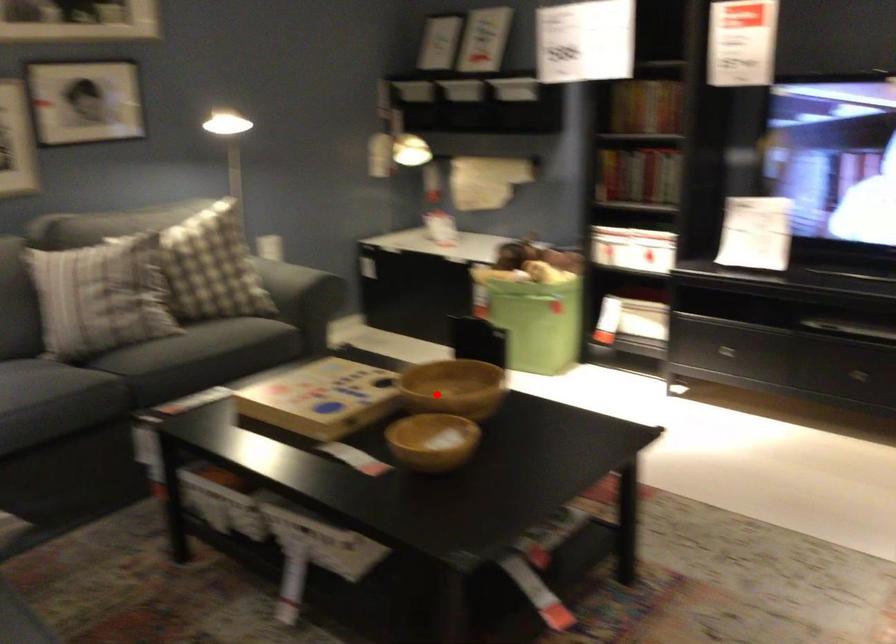
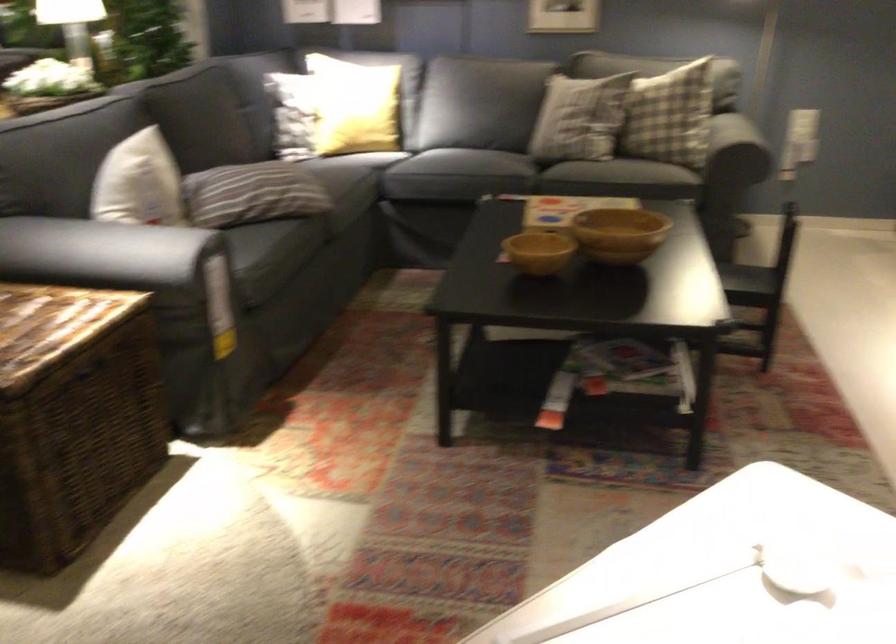
Question: I am providing you with two images of the same scene from different viewpoints. Given a red point in image1, look at the same physical point in image2. Is it:

Choices:
 (A) Closer to the viewpoint
 (B) Farther from the viewpoint

Answer: (B)